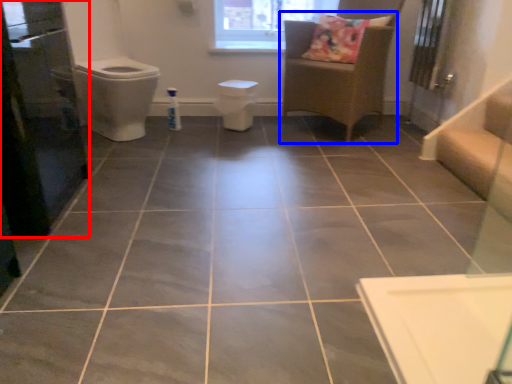
Question: Which object appears closest to the camera in this image, screen door (highlighted by a red box) or furniture (highlighted by a blue box)?

Choices:
 (A) screen door
 (B) furniture

Answer: (A)